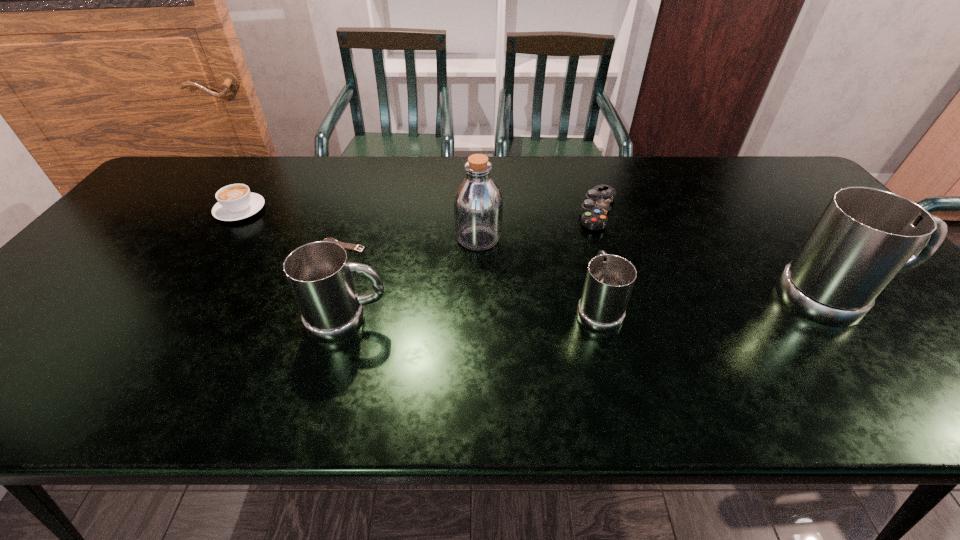
I want to click on vacant point located between the shortest mug and the cappuccino, so click(x=419, y=259).

Identify the location of free space between the rightmost object and the second shortest object. (716, 254).

You are a GUI agent. You are given a task and a screenshot of the screen. Output one action in this format:
    pyautogui.click(x=<x>, y=<y>)
    Task: Click on the free space between the cappuccino and the shortest object
    The image size is (960, 540).
    Given the screenshot: What is the action you would take?
    pyautogui.click(x=292, y=228)

The width and height of the screenshot is (960, 540). I want to click on free space between the control and the rightmost object, so click(x=716, y=254).

This screenshot has width=960, height=540. What are the coordinates of `free point between the rightmost mug and the cappuccino` in the screenshot? It's located at (538, 254).

The height and width of the screenshot is (540, 960). I want to click on the closest object to the leftmost object, so coord(349,246).

Select which object appears as the second closest to the shortest mug. Please provide its 2D coordinates. Your answer should be formatted as a tuple, i.e. [(x, y)], where the tuple contains the x and y coordinates of a point satisfying the conditions above.

[(594, 209)]

Identify the location of mug that is the second closest to the tallest mug. This screenshot has height=540, width=960. (320, 276).

Locate an element on the screen. mug object that ranks as the second closest to the tallest mug is located at coordinates (320, 276).

The image size is (960, 540). Identify the location of free point that satisfies the following two spatial constraints: 1. on the side of the control with the handle; 2. on the right side of the shortest mug. (572, 211).